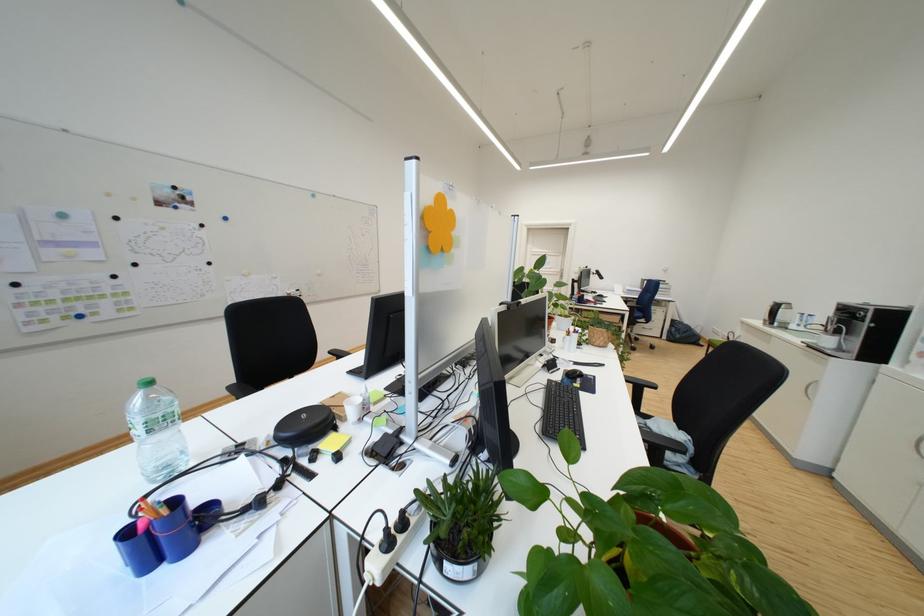
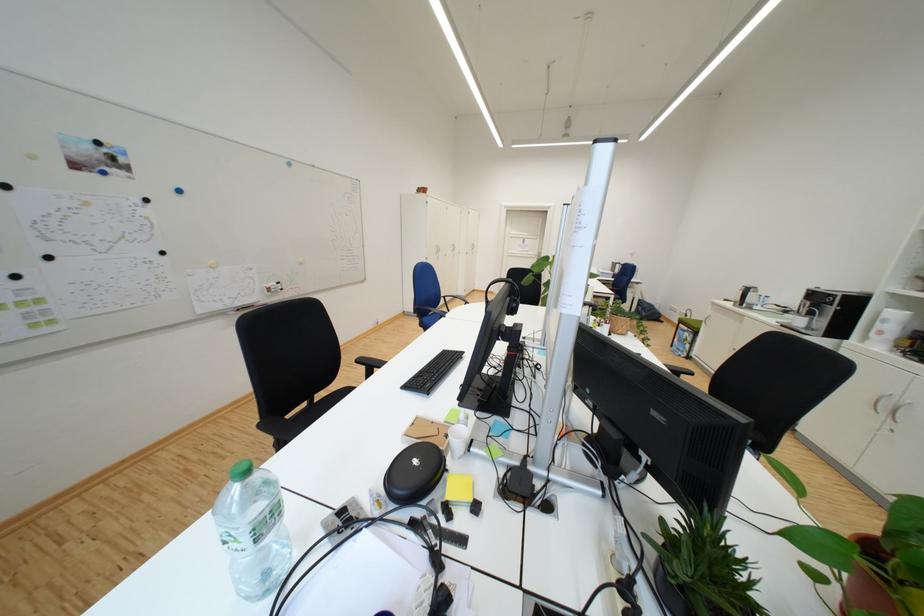
Question: The camera is either moving clockwise (left) or counter-clockwise (right) around the object. The first image is from the beginning of the video and the second image is from the end. Is the camera moving left or right when shooting the video?

Choices:
 (A) Left
 (B) Right

Answer: (A)